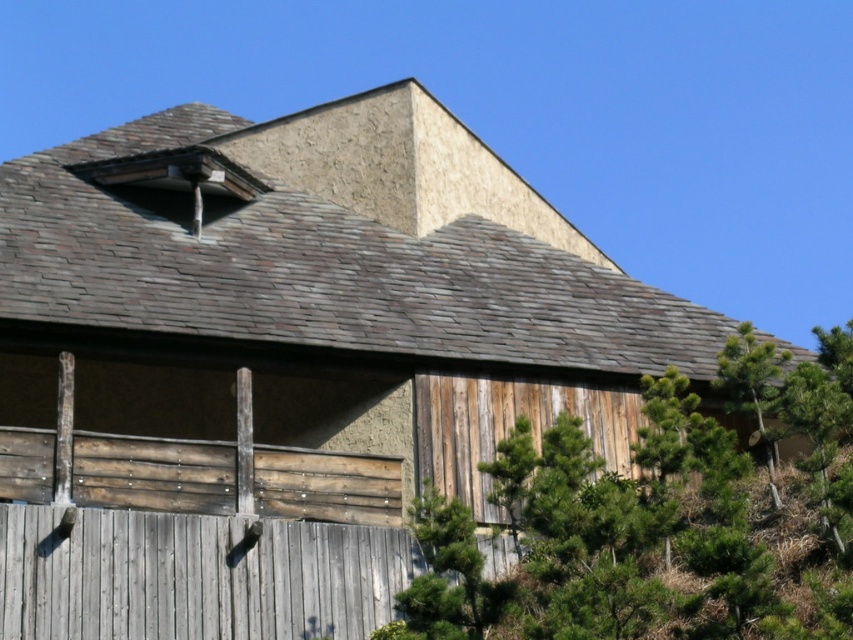
You are standing in front of the rustic building and notice two trees. The green leafy tree at center and the green textured pine tree at right. Which tree is positioned lower relative to the other?

The green leafy tree at center is located below the green textured pine tree at right, so the green leafy tree at center is positioned lower.